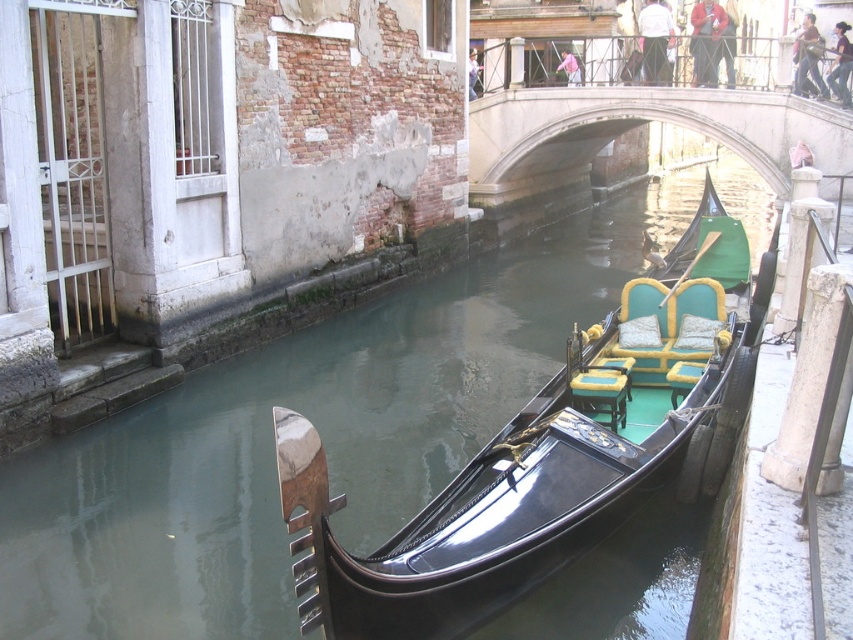
Does shiny black gondola at center have a greater height compared to teal fabric cushion at center?

Yes, shiny black gondola at center is taller than teal fabric cushion at center.

Between shiny black gondola at center and teal fabric cushion at center, which one is positioned lower?

teal fabric cushion at center

Where is `shiny black gondola at center`? The height and width of the screenshot is (640, 853). shiny black gondola at center is located at coordinates (546, 458).

Which is behind, point (590, 104) or point (596, 336)?

Positioned behind is point (590, 104).

Does concrete stone bridge at center appear under teal fabric cushion at center?

Incorrect, concrete stone bridge at center is not positioned below teal fabric cushion at center.

Find the location of a particular element. Image resolution: width=853 pixels, height=640 pixels. concrete stone bridge at center is located at coordinates 634,128.

Can you confirm if shiny black gondola at center is bigger than concrete stone bridge at center?

Yes, shiny black gondola at center is bigger than concrete stone bridge at center.

Identify the location of shiny black gondola at center. The width and height of the screenshot is (853, 640). (546, 458).